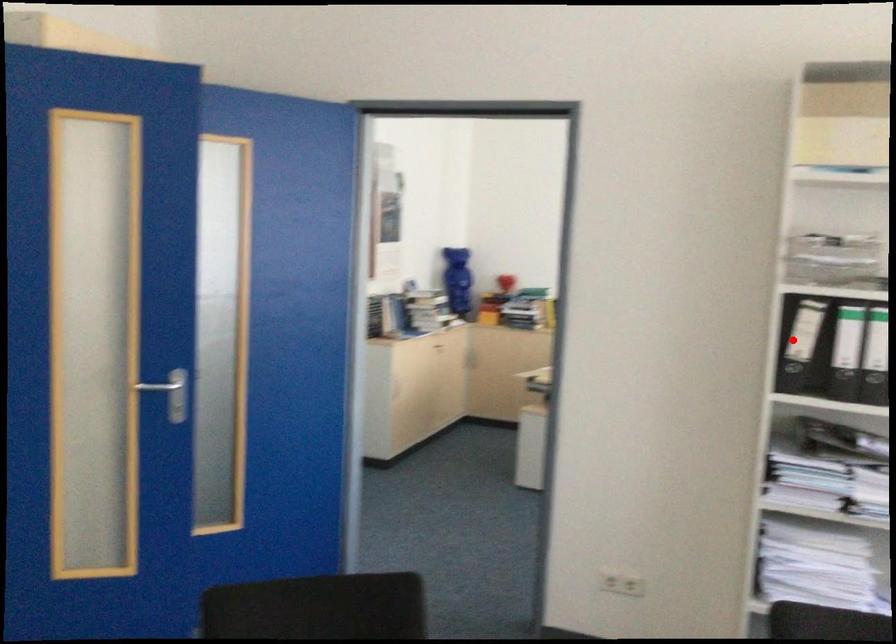
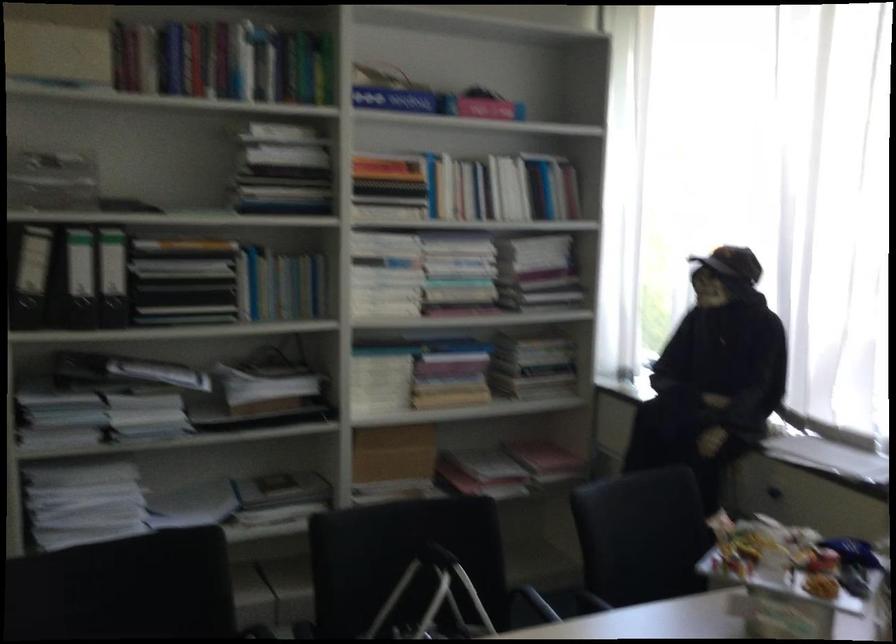
In the second image, find the point that corresponds to the highlighted location in the first image.

(29, 274)